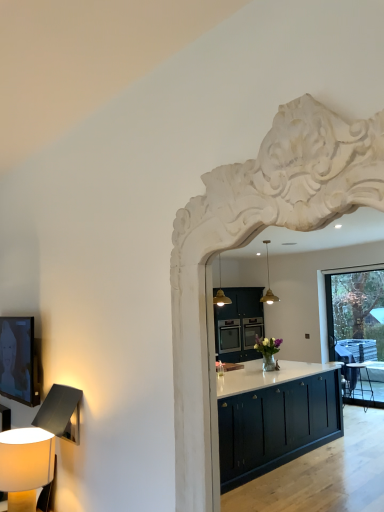
Describe the element at coordinates (25, 465) in the screenshot. I see `matte beige lampshade at lower left` at that location.

Where is `matte beige lampshade at lower left`? Image resolution: width=384 pixels, height=512 pixels. matte beige lampshade at lower left is located at coordinates (25, 465).

Measure the distance between white carved wood archway at upper center and camera.

A distance of 79.10 centimeters exists between white carved wood archway at upper center and camera.

Measure the distance between point (x=196, y=502) and camera.

Point (x=196, y=502) and camera are 1.21 meters apart.

Describe the element at coordinates (247, 243) in the screenshot. This screenshot has height=512, width=384. I see `white carved wood archway at upper center` at that location.

Where is `white carved wood archway at upper center`? white carved wood archway at upper center is located at coordinates (247, 243).

What is the approximate width of white carved wood archway at upper center?

6.87 centimeters.

You are a GUI agent. You are given a task and a screenshot of the screen. Output one action in this format:
    pyautogui.click(x=<x>, y=<y>)
    Task: Click on the matte beige lampshade at lower left
    This screenshot has width=384, height=512.
    Given the screenshot: What is the action you would take?
    pyautogui.click(x=25, y=465)

Considering the relative positions of white carved wood archway at upper center and matte beige lampshade at lower left in the image provided, is white carved wood archway at upper center to the left or to the right of matte beige lampshade at lower left?

Based on their positions, white carved wood archway at upper center is located to the right of matte beige lampshade at lower left.

Considering the positions of objects white carved wood archway at upper center and matte beige lampshade at lower left in the image provided, who is behind, white carved wood archway at upper center or matte beige lampshade at lower left?

matte beige lampshade at lower left is further from the camera.

Does point (188, 490) come behind point (15, 443)?

No.

From the image's perspective, is white carved wood archway at upper center positioned above or below matte beige lampshade at lower left?

Clearly, from the image's perspective, white carved wood archway at upper center is above matte beige lampshade at lower left.

From a real-world perspective, is white carved wood archway at upper center under matte beige lampshade at lower left?

No.

Considering the sizes of objects white carved wood archway at upper center and matte beige lampshade at lower left in the image provided, who is wider, white carved wood archway at upper center or matte beige lampshade at lower left?

matte beige lampshade at lower left.

Can you confirm if white carved wood archway at upper center is taller than matte beige lampshade at lower left?

Indeed, white carved wood archway at upper center has a greater height compared to matte beige lampshade at lower left.

Can you confirm if white carved wood archway at upper center is smaller than matte beige lampshade at lower left?

Incorrect, white carved wood archway at upper center is not smaller in size than matte beige lampshade at lower left.

Based on the photo, choose the correct answer: Is white carved wood archway at upper center inside matte beige lampshade at lower left or outside it?

white carved wood archway at upper center is spatially situated outside matte beige lampshade at lower left.

Is white carved wood archway at upper center touching matte beige lampshade at lower left?

white carved wood archway at upper center and matte beige lampshade at lower left are clearly separated.

Is white carved wood archway at upper center turned away from matte beige lampshade at lower left?

white carved wood archway at upper center does not have its back to matte beige lampshade at lower left.

Identify the location of table lamp behind the white carved wood archway at upper center. (25, 465).

Which is more to the right, matte beige lampshade at lower left or white carved wood archway at upper center?

white carved wood archway at upper center is more to the right.

In the image, is matte beige lampshade at lower left positioned in front of or behind white carved wood archway at upper center?

Visually, matte beige lampshade at lower left is located behind white carved wood archway at upper center.

Considering the positions of points (24, 505) and (348, 137), is point (24, 505) closer to camera compared to point (348, 137)?

No, (24, 505) is further to viewer.

From the image's perspective, which object appears higher, matte beige lampshade at lower left or white carved wood archway at upper center?

white carved wood archway at upper center, from the image's perspective.

From a real-world perspective, does matte beige lampshade at lower left sit lower than white carved wood archway at upper center?

Correct, in the physical world, matte beige lampshade at lower left is lower than white carved wood archway at upper center.

Between matte beige lampshade at lower left and white carved wood archway at upper center, which one has larger width?

With larger width is matte beige lampshade at lower left.

Is matte beige lampshade at lower left taller or shorter than white carved wood archway at upper center?

matte beige lampshade at lower left is shorter than white carved wood archway at upper center.

Considering the relative sizes of matte beige lampshade at lower left and white carved wood archway at upper center in the image provided, is matte beige lampshade at lower left bigger than white carved wood archway at upper center?

Incorrect, matte beige lampshade at lower left is not larger than white carved wood archway at upper center.

Based on the photo, which is correct: matte beige lampshade at lower left is inside white carved wood archway at upper center, or outside of it?

matte beige lampshade at lower left exists outside the volume of white carved wood archway at upper center.

Is matte beige lampshade at lower left touching white carved wood archway at upper center?

No, matte beige lampshade at lower left is not with white carved wood archway at upper center.

Is white carved wood archway at upper center at the back of matte beige lampshade at lower left?

That's not correct — matte beige lampshade at lower left is not looking away from white carved wood archway at upper center.

What's the angular difference between matte beige lampshade at lower left and white carved wood archway at upper center's facing directions?

2.27 degrees.

Measure the distance from matte beige lampshade at lower left to white carved wood archway at upper center.

91.06 centimeters.

At what (x,y) coordinates should I click in order to perform the action: click on archway lying above the matte beige lampshade at lower left (from the image's perspective). Please return your answer as a coordinate pair (x, y). Looking at the image, I should click on pos(247,243).

This screenshot has width=384, height=512. There is a matte beige lampshade at lower left. What are the coordinates of `archway above it (from a real-world perspective)` in the screenshot? It's located at (247, 243).

Identify the location of table lamp that is under the white carved wood archway at upper center (from a real-world perspective). The height and width of the screenshot is (512, 384). (25, 465).